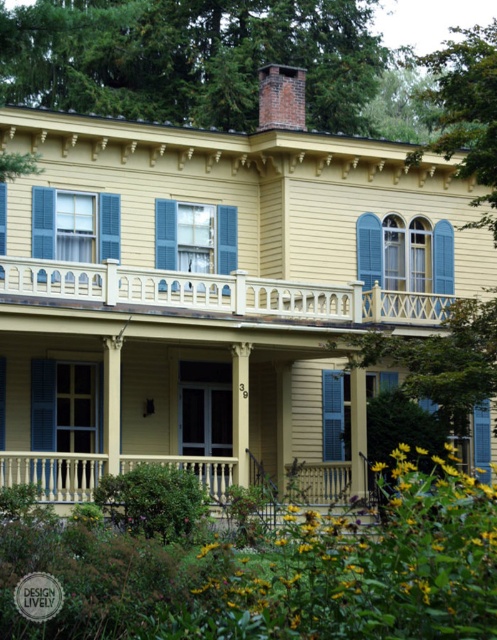
From the picture: Does yellow wood railing at upper center come behind blue painted wood shutter at center?

No, it is in front of blue painted wood shutter at center.

Is yellow wood railing at upper center to the left of blue painted wood shutter at center from the viewer's perspective?

Yes, yellow wood railing at upper center is to the left of blue painted wood shutter at center.

Which is in front, point (168, 305) or point (340, 449)?

Positioned in front is point (168, 305).

You are a GUI agent. You are given a task and a screenshot of the screen. Output one action in this format:
    pyautogui.click(x=<x>, y=<y>)
    Task: Click on the yellow wood railing at upper center
    The width and height of the screenshot is (497, 640).
    Given the screenshot: What is the action you would take?
    pyautogui.click(x=220, y=292)